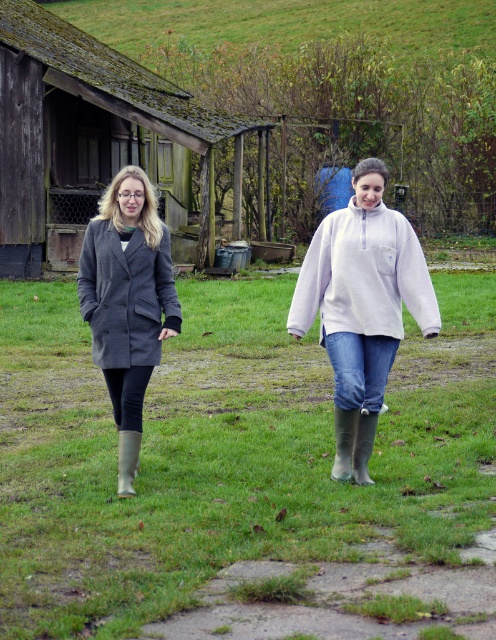
In the scene shown: You are standing in a field and see the green matte grass at center and the wooden hut at left. Which object is located to the left of the other?

The wooden hut at left is located to the left of the green matte grass at center.

You are standing at the origin point in the image. Which direction should you move to reach the green matte grass at center?

The green matte grass at center is located at point (209, 465), so you should move towards the center of the image to reach it.

From the picture: You are standing at the origin point of the coordinate system. You want to walk to the green matte grass at center. Which direction should you walk? Please provide your answer in terms of the coordinate system. For example, if the grass is at coordinate point 0.5,0.5, you can say the grass is at the center point of the coordinate system.

The green matte grass at center is located at coordinate point (209, 465), so you should walk towards the right and slightly downward from the origin point to reach it.